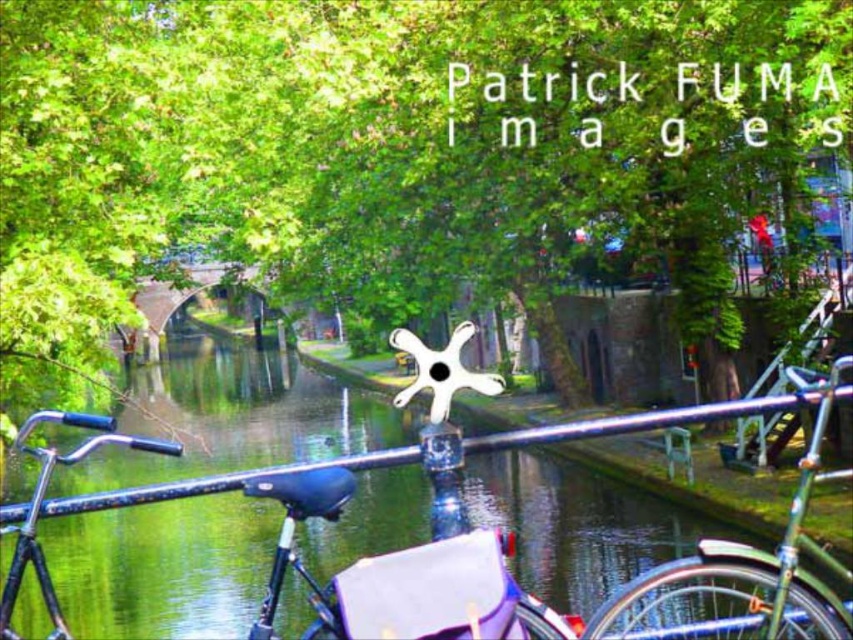
Who is higher up, green leafy tree at center or green smooth water at center?

green leafy tree at center is higher up.

Is green leafy tree at center positioned at the back of green smooth water at center?

Yes, green leafy tree at center is further from the viewer.

Does point (508, 186) come closer to viewer compared to point (819, 557)?

No, (508, 186) is behind (819, 557).

Where is `green leafy tree at center`? The height and width of the screenshot is (640, 853). green leafy tree at center is located at coordinates (373, 148).

Does green leafy tree at center have a greater width compared to shiny blue bicycle at center?

Indeed, green leafy tree at center has a greater width compared to shiny blue bicycle at center.

Who is positioned more to the right, green leafy tree at center or shiny blue bicycle at center?

green leafy tree at center is more to the right.

Find the location of a particular element. The width and height of the screenshot is (853, 640). green leafy tree at center is located at coordinates pos(373,148).

Locate an element on the screen. green leafy tree at center is located at coordinates (373, 148).

Consider the image. Does green leafy tree at center have a greater height compared to green matte bicycle at center?

Yes.

Locate an element on the screen. The image size is (853, 640). green leafy tree at center is located at coordinates (373, 148).